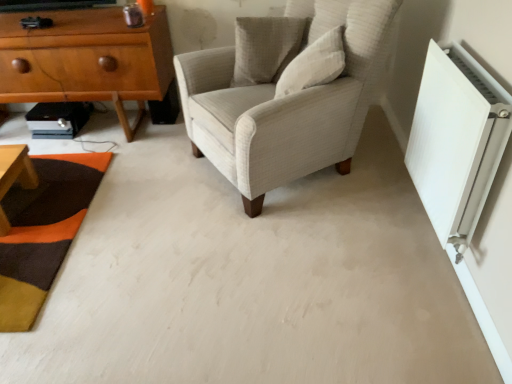
Identify the location of free space above textured wool mat at lower left (from a real-world perspective). (45, 207).